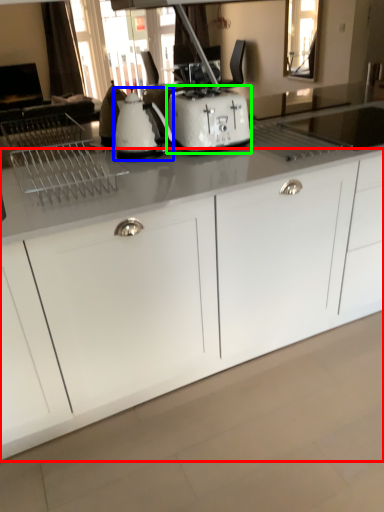
Question: Estimate the real-world distances between objects in this image. Which object is closer to cabinetry (highlighted by a red box), kitchen appliance (highlighted by a blue box) or toaster (highlighted by a green box)?

Choices:
 (A) kitchen appliance
 (B) toaster

Answer: (B)